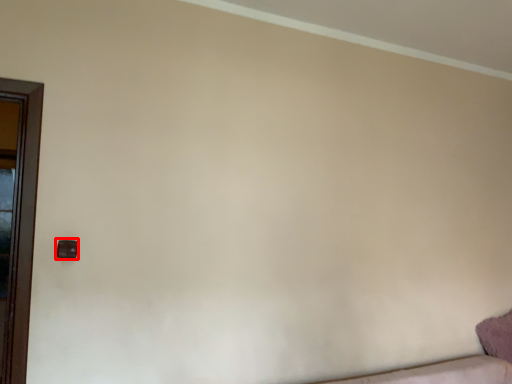
Question: From the image's perspective, what is the correct spatial positioning of door handle (annotated by the red box) in reference to pillow?

Choices:
 (A) above
 (B) below

Answer: (A)